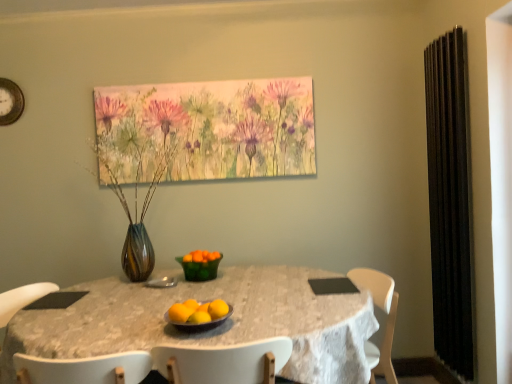
Where is `vacant space to the left of green glass bowl at center`? Image resolution: width=512 pixels, height=384 pixels. vacant space to the left of green glass bowl at center is located at coordinates (160, 279).